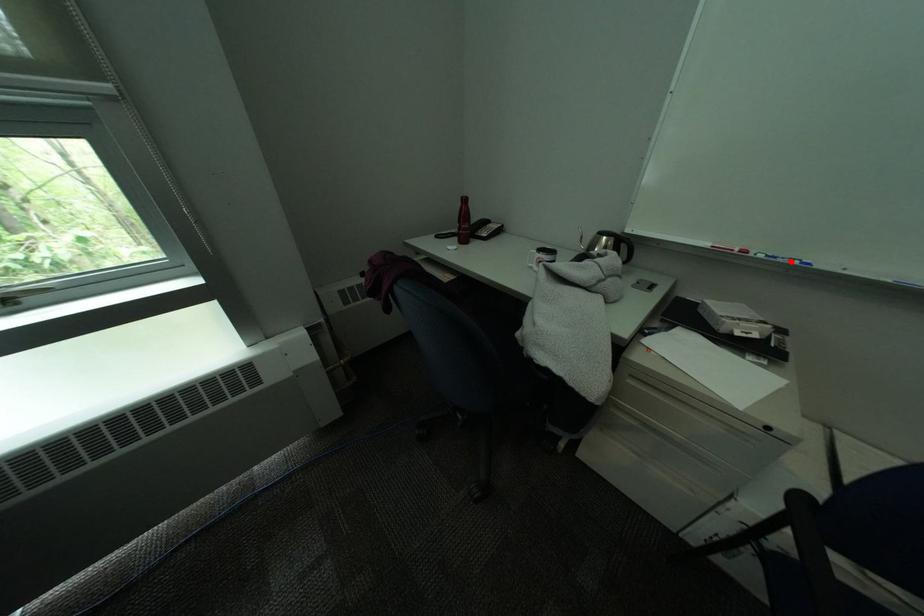
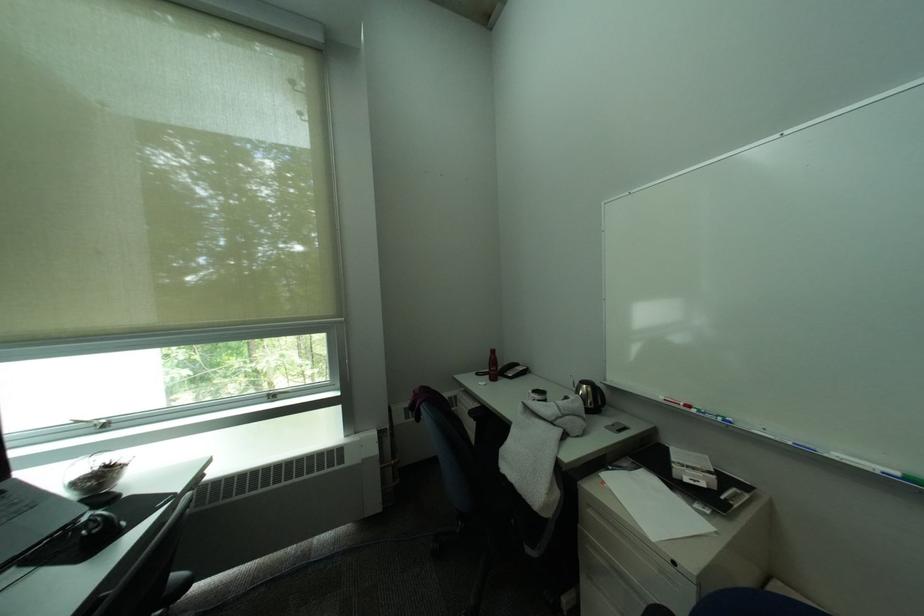
Where in the second image is the point corresponding to the highlighted location from the first image?

(719, 416)